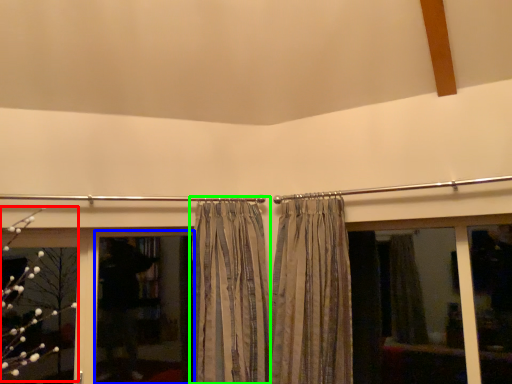
Question: Which is farther away from flower (highlighted by a red box)? screen door (highlighted by a blue box) or curtain (highlighted by a green box)?

Choices:
 (A) screen door
 (B) curtain

Answer: (B)